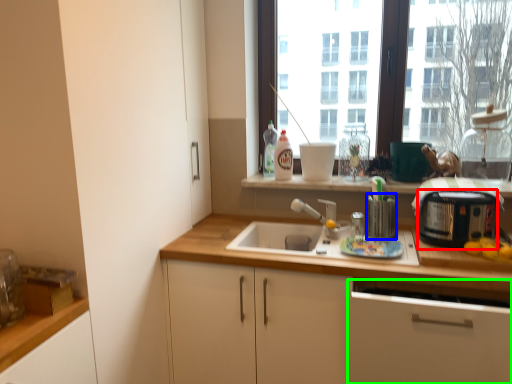
Question: Considering the real-world distances, which object is farthest from appliance (highlighted by a red box)? appliance (highlighted by a blue box) or cabinetry (highlighted by a green box)?

Choices:
 (A) appliance
 (B) cabinetry

Answer: (B)